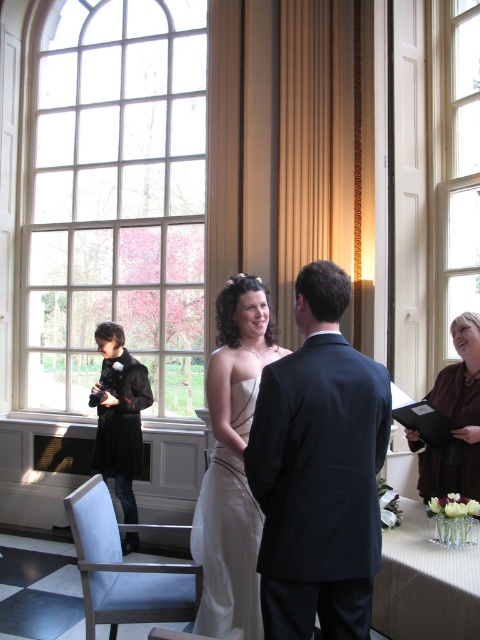
Question: Which is nearer to the dark blue suit at center?

Choices:
 (A) brown fuzzy coat at lower right
 (B) ivory satin dress at center
 (C) clear glass vase at lower right
 (D) clear glass window at left

Answer: (B)

Question: Which object is farther from the camera taking this photo?

Choices:
 (A) black wool coat at left
 (B) brown fuzzy coat at lower right
 (C) clear glass window at upper right

Answer: (A)

Question: Can you confirm if dark blue suit at center is positioned to the right of clear glass vase at lower right?

Choices:
 (A) no
 (B) yes

Answer: (A)

Question: Is dark blue suit at center below brown fuzzy coat at lower right?

Choices:
 (A) yes
 (B) no

Answer: (B)

Question: Which point is farther to the camera?

Choices:
 (A) dark blue suit at center
 (B) clear glass vase at lower right
 (C) ivory satin dress at center
 (D) clear glass window at upper right

Answer: (D)

Question: Can you confirm if clear glass vase at lower right is positioned to the left of black wool coat at left?

Choices:
 (A) yes
 (B) no

Answer: (B)